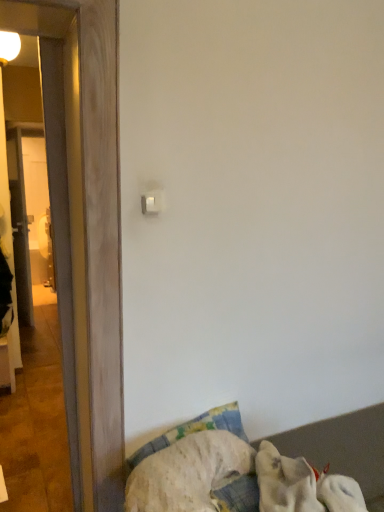
At what (x,y) coordinates should I click in order to perform the action: click on wooden door at left. Please return your answer as a coordinate pair (x, y). Looking at the image, I should click on (88, 237).

Where is `white plastic light switch at upper center`? This screenshot has height=512, width=384. white plastic light switch at upper center is located at coordinates (152, 202).

Can you confirm if white plastic light switch at upper center is thinner than white fabric at lower right?

Yes.

Does white plastic light switch at upper center appear on the right side of white fabric at lower right?

No, white plastic light switch at upper center is not to the right of white fabric at lower right.

From a real-world perspective, who is located lower, white plastic light switch at upper center or white fabric at lower right?

white fabric at lower right is physically lower.

Considering the sizes of objects wooden door at left and white soft dog at lower right in the image provided, who is taller, wooden door at left or white soft dog at lower right?

Standing taller between the two is wooden door at left.

Is wooden door at left beside white soft dog at lower right?

No.

Is white soft dog at lower right at the back of wooden door at left?

No.

Is white soft dog at lower right facing towards white plastic light switch at upper center?

No.

Considering the relative sizes of white soft dog at lower right and white plastic light switch at upper center in the image provided, is white soft dog at lower right bigger than white plastic light switch at upper center?

Yes.

Is white soft dog at lower right not inside white plastic light switch at upper center?

Indeed, white soft dog at lower right is completely outside white plastic light switch at upper center.

From a real-world perspective, is wooden door at left on top of white fabric at lower right?

Yes, from a real-world perspective, wooden door at left is over white fabric at lower right

Does wooden door at left lie in front of white fabric at lower right?

No, wooden door at left is further to the viewer.

From the image's perspective, is wooden door at left on white fabric at lower right?

Yes, from the image's perspective, wooden door at left is above white fabric at lower right.

Is wooden door at left oriented away from white fabric at lower right?

wooden door at left is not turned away from white fabric at lower right.

Consider the image. Does white soft dog at lower right touch wooden door at left?

No, white soft dog at lower right is not with wooden door at left.

Is white soft dog at lower right bigger than wooden door at left?

Incorrect, white soft dog at lower right is not larger than wooden door at left.

From the image's perspective, is white soft dog at lower right on top of wooden door at left?

No, from the image's perspective, white soft dog at lower right is not over wooden door at left.

Does white soft dog at lower right have a lesser height compared to wooden door at left?

Yes, white soft dog at lower right is shorter than wooden door at left.

From a real-world perspective, is white plastic light switch at upper center positioned over wooden door at left based on gravity?

Yes, from a real-world perspective, white plastic light switch at upper center is above wooden door at left.

You are a GUI agent. You are given a task and a screenshot of the screen. Output one action in this format:
    pyautogui.click(x=<x>, y=<y>)
    Task: Click on the door that is below the white plastic light switch at upper center (from the image's perspective)
    This screenshot has width=384, height=512.
    Given the screenshot: What is the action you would take?
    click(88, 237)

Does white plastic light switch at upper center contain wooden door at left?

No, wooden door at left is not surrounded by white plastic light switch at upper center.

Consider the image. Is the position of white plastic light switch at upper center less distant than that of wooden door at left?

No, it is not.

Does white fabric at lower right come in front of wooden door at left?

Yes, the depth of white fabric at lower right is less than that of wooden door at left.

From the image's perspective, would you say white fabric at lower right is positioned over wooden door at left?

No, from the image's perspective, white fabric at lower right is not over wooden door at left.

From a real-world perspective, which is physically below, white fabric at lower right or wooden door at left?

From a 3D spatial view, white fabric at lower right is below.

Could you tell me if white fabric at lower right is facing wooden door at left?

No.

Image resolution: width=384 pixels, height=512 pixels. Find the location of `light switch on the left of white fabric at lower right`. light switch on the left of white fabric at lower right is located at coordinates (152, 202).

Where is `door behind the white soft dog at lower right`? This screenshot has width=384, height=512. door behind the white soft dog at lower right is located at coordinates [88, 237].

Looking at the image, which one is located further to wooden door at left, white fabric at lower right or white soft dog at lower right?

Among the two, white fabric at lower right is located further to wooden door at left.

From the image, which object appears to be farther from white fabric at lower right, wooden door at left or white soft dog at lower right?

The object further to white fabric at lower right is wooden door at left.

Based on their spatial positions, is white plastic light switch at upper center or wooden door at left closer to white soft dog at lower right?

wooden door at left lies closer to white soft dog at lower right than the other object.

Estimate the real-world distances between objects in this image. Which object is further from wooden door at left, white soft dog at lower right or white fabric at lower right?

Among the two, white fabric at lower right is located further to wooden door at left.

Which object lies nearer to the anchor point wooden door at left, white fabric at lower right or white plastic light switch at upper center?

white plastic light switch at upper center.

From the image, which object appears to be nearer to white plastic light switch at upper center, wooden door at left or white soft dog at lower right?

wooden door at left lies closer to white plastic light switch at upper center than the other object.

Based on their spatial positions, is wooden door at left or white fabric at lower right further from white soft dog at lower right?

Based on the image, wooden door at left appears to be further to white soft dog at lower right.

From the image, which object appears to be farther from white fabric at lower right, white plastic light switch at upper center or white soft dog at lower right?

white plastic light switch at upper center.

The width and height of the screenshot is (384, 512). In order to click on door between white plastic light switch at upper center and white fabric at lower right in the vertical direction in this screenshot , I will do `click(88, 237)`.

The width and height of the screenshot is (384, 512). What are the coordinates of `dog that lies between white plastic light switch at upper center and white fabric at lower right from top to bottom` in the screenshot? It's located at (302, 486).

Locate an element on the screen. dog between wooden door at left and white fabric at lower right in the horizontal direction is located at coordinates (302, 486).

I want to click on door between white plastic light switch at upper center and white soft dog at lower right in the up-down direction, so click(88, 237).